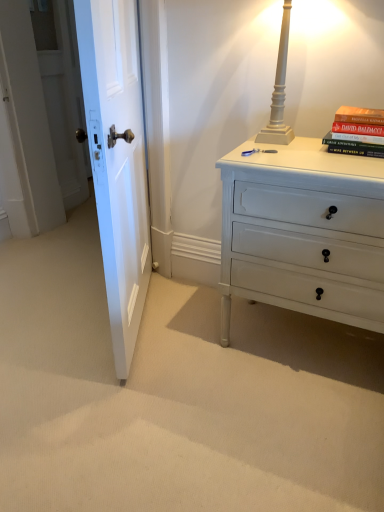
Question: Does white painted wood table lamp at upper right have a larger size compared to hardcover book at upper right?

Choices:
 (A) no
 (B) yes

Answer: (B)

Question: Is white painted wood table lamp at upper right oriented towards hardcover book at upper right?

Choices:
 (A) yes
 (B) no

Answer: (B)

Question: Are white painted wood table lamp at upper right and hardcover book at upper right far apart?

Choices:
 (A) yes
 (B) no

Answer: (B)

Question: From a real-world perspective, does white painted wood table lamp at upper right sit lower than hardcover book at upper right?

Choices:
 (A) yes
 (B) no

Answer: (B)

Question: From a real-world perspective, is white painted wood table lamp at upper right on hardcover book at upper right?

Choices:
 (A) yes
 (B) no

Answer: (A)

Question: Can you confirm if white painted wood table lamp at upper right is positioned to the right of hardcover book at upper right?

Choices:
 (A) no
 (B) yes

Answer: (A)

Question: Does white wooden door at left have a greater height compared to hardcover book at upper right?

Choices:
 (A) yes
 (B) no

Answer: (A)

Question: From the image's perspective, is white wooden door at left beneath hardcover book at upper right?

Choices:
 (A) yes
 (B) no

Answer: (A)

Question: Considering the relative sizes of white wooden door at left and hardcover book at upper right in the image provided, is white wooden door at left bigger than hardcover book at upper right?

Choices:
 (A) yes
 (B) no

Answer: (A)

Question: Does white wooden door at left appear on the left side of hardcover book at upper right?

Choices:
 (A) no
 (B) yes

Answer: (B)

Question: From a real-world perspective, does white wooden door at left stand above hardcover book at upper right?

Choices:
 (A) yes
 (B) no

Answer: (B)

Question: Is white wooden door at left located outside hardcover book at upper right?

Choices:
 (A) no
 (B) yes

Answer: (B)

Question: From the image's perspective, is white painted wood chest of drawers at right beneath hardcover book at upper right?

Choices:
 (A) yes
 (B) no

Answer: (A)